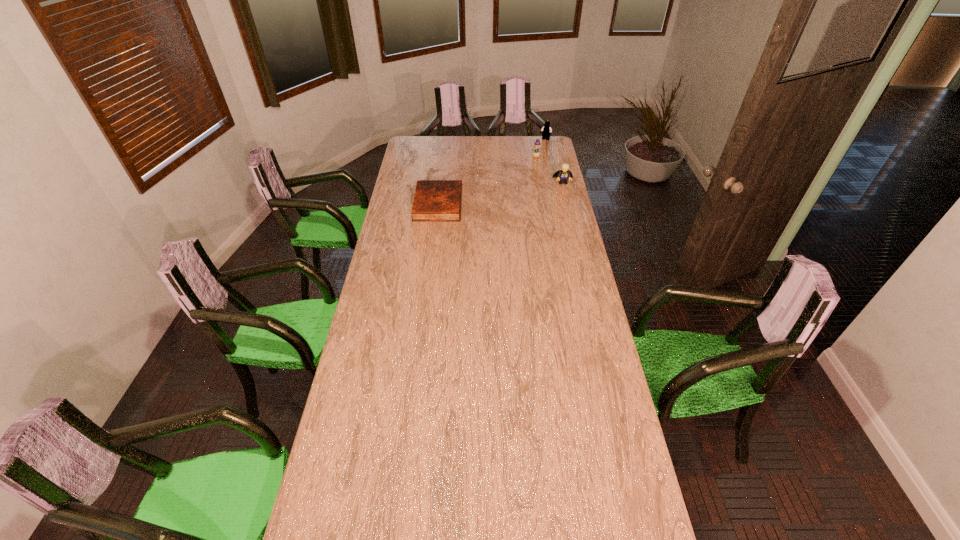
This screenshot has width=960, height=540. Find the location of `free region located 0.070m on the face of the third object from right to left, where the monocle is placed`. free region located 0.070m on the face of the third object from right to left, where the monocle is placed is located at coordinates (529, 165).

At what (x,y) coordinates should I click in order to perform the action: click on vacant space situated on the front-facing side of the farthest object. Please return your answer as a coordinate pair (x, y). This screenshot has height=540, width=960. Looking at the image, I should click on (534, 161).

At what (x,y) coordinates should I click in order to perform the action: click on vacant space located 0.290m on the front-facing side of the farthest object. Please return your answer as a coordinate pair (x, y). The image size is (960, 540). Looking at the image, I should click on (532, 164).

Locate an element on the screen. vacant space located 0.200m on the front-facing side of the farthest object is located at coordinates (536, 157).

Where is `object situated at the far edge`? The height and width of the screenshot is (540, 960). object situated at the far edge is located at coordinates (546, 129).

Identify the location of object that is at the left edge. Image resolution: width=960 pixels, height=540 pixels. [x=435, y=200].

What are the coordinates of `duckling present at the right edge` in the screenshot? It's located at (536, 153).

This screenshot has height=540, width=960. What are the coordinates of `object that is positioned at the far right corner` in the screenshot? It's located at [546, 129].

In the image, there is a desktop. Identify the location of vacant space at the far edge. (455, 141).

At what (x,y) coordinates should I click in order to perform the action: click on free space at the left edge. Please return your answer as a coordinate pair (x, y). Looking at the image, I should click on (372, 301).